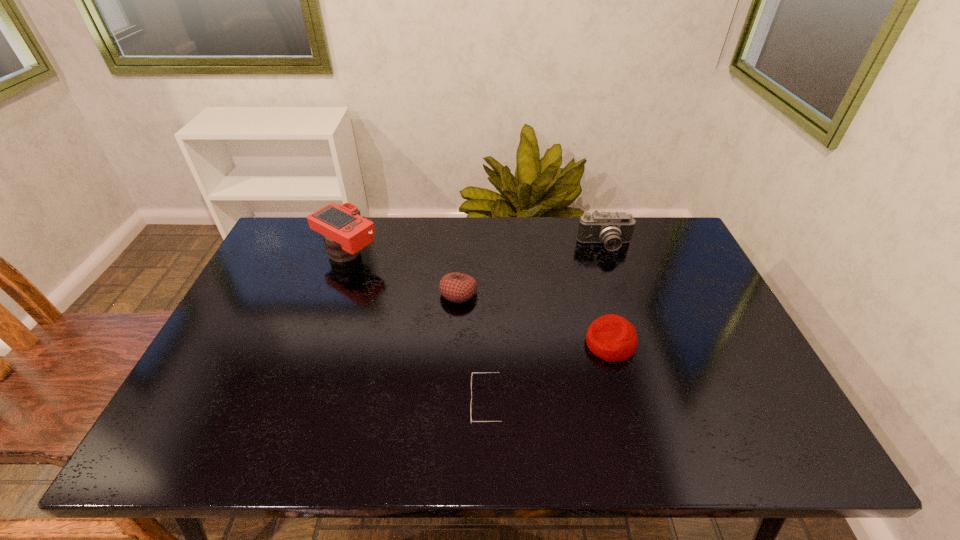
Where is `object present at the left edge`? The image size is (960, 540). object present at the left edge is located at coordinates (346, 232).

Where is `object that is at the far left corner`? This screenshot has width=960, height=540. object that is at the far left corner is located at coordinates (346, 232).

In order to click on free space at the far edge of the desktop in this screenshot , I will do `click(534, 242)`.

In order to click on vacant area at the near edge in this screenshot , I will do `click(479, 425)`.

Identify the location of vacant space at the left edge. (207, 373).

Locate an element on the screen. This screenshot has width=960, height=540. blank area at the right edge is located at coordinates (681, 308).

Identify the location of vacant space at the far left corner. This screenshot has height=540, width=960. (301, 219).

Image resolution: width=960 pixels, height=540 pixels. In the image, there is a desktop. Find the location of `vacant space at the far right corner`. vacant space at the far right corner is located at coordinates pyautogui.click(x=644, y=228).

At what (x,y) coordinates should I click in order to perform the action: click on free spot between the third farthest object and the shorter camera. Please return your answer as a coordinate pair (x, y). Image resolution: width=960 pixels, height=540 pixels. Looking at the image, I should click on (532, 269).

Locate an element on the screen. Image resolution: width=960 pixels, height=540 pixels. vacant space that is in between the left beanbag and the nearest object is located at coordinates (477, 348).